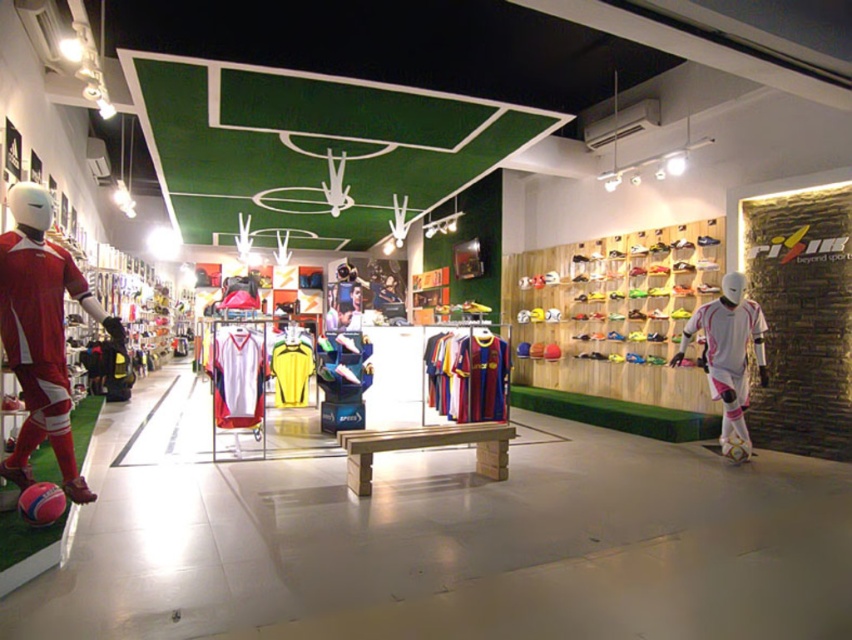
Question: Can you confirm if matte red soccer uniform at left is smaller than white matte soccer player at right?

Choices:
 (A) no
 (B) yes

Answer: (B)

Question: Which point is closer to the camera?

Choices:
 (A) (698, 330)
 (B) (45, 296)

Answer: (B)

Question: Which point is closer to the camera taking this photo?

Choices:
 (A) (20, 387)
 (B) (735, 346)

Answer: (A)

Question: Can you confirm if matte red soccer uniform at left is positioned to the right of white matte soccer player at right?

Choices:
 (A) no
 (B) yes

Answer: (A)

Question: Which point appears farthest from the camera in this image?

Choices:
 (A) (12, 305)
 (B) (741, 355)

Answer: (B)

Question: Is matte red soccer uniform at left wider than white matte soccer player at right?

Choices:
 (A) yes
 (B) no

Answer: (B)